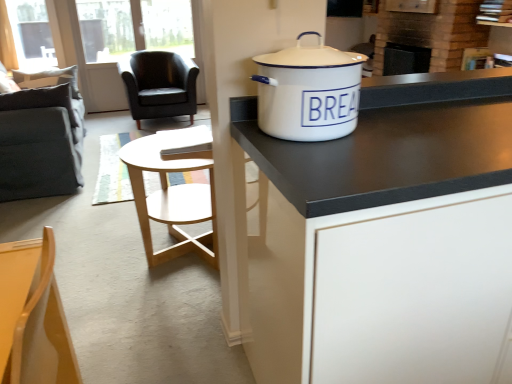
Question: Considering the relative positions of black matte cabinet at center and white enamel pot at upper right in the image provided, is black matte cabinet at center in front of white enamel pot at upper right?

Choices:
 (A) no
 (B) yes

Answer: (B)

Question: Is white enamel pot at upper right inside black matte cabinet at center?

Choices:
 (A) no
 (B) yes

Answer: (A)

Question: Is black matte cabinet at center not near white enamel pot at upper right?

Choices:
 (A) no
 (B) yes

Answer: (A)

Question: Considering the relative sizes of black matte cabinet at center and white enamel pot at upper right in the image provided, is black matte cabinet at center taller than white enamel pot at upper right?

Choices:
 (A) no
 (B) yes

Answer: (B)

Question: Is black matte cabinet at center to the left of white enamel pot at upper right from the viewer's perspective?

Choices:
 (A) no
 (B) yes

Answer: (A)

Question: Looking at the image, does black leather chair at upper left, placed as the first chair when sorted from back to front, seem bigger or smaller compared to white enamel pot at upper right?

Choices:
 (A) big
 (B) small

Answer: (A)

Question: From the image's perspective, is black leather chair at upper left, arranged as the first chair when viewed from the top, above or below white enamel pot at upper right?

Choices:
 (A) above
 (B) below

Answer: (A)

Question: Looking at their shapes, would you say black leather chair at upper left, which is the 2th chair in right-to-left order, is wider or thinner than white enamel pot at upper right?

Choices:
 (A) thin
 (B) wide

Answer: (B)

Question: Is point [x=158, y=82] closer or farther from the camera than point [x=321, y=96]?

Choices:
 (A) closer
 (B) farther

Answer: (B)

Question: From a real-world perspective, is wooden chair at lower left, acting as the 2th chair starting from the back, above or below black leather chair at upper left, the 2th chair when ordered from bottom to top?

Choices:
 (A) above
 (B) below

Answer: (A)

Question: Do you think wooden chair at lower left, the 1th chair from the bottom, is within black leather chair at upper left, placed as the first chair when sorted from back to front, or outside of it?

Choices:
 (A) outside
 (B) inside

Answer: (A)

Question: Is wooden chair at lower left, which is the 2th chair in top-to-bottom order, in front of or behind black leather chair at upper left, which is the 2th chair in right-to-left order, in the image?

Choices:
 (A) front
 (B) behind

Answer: (A)

Question: From the image's perspective, is wooden chair at lower left, acting as the 2th chair starting from the back, above or below black leather chair at upper left, arranged as the first chair when viewed from the top?

Choices:
 (A) below
 (B) above

Answer: (A)

Question: From a real-world perspective, relative to wooden chair at lower left, acting as the 2th chair starting from the back, is dark gray fabric swivel chair at left vertically above or below?

Choices:
 (A) above
 (B) below

Answer: (B)

Question: Choose the correct answer: Is dark gray fabric swivel chair at left inside wooden chair at lower left, marked as the 1th chair in a right-to-left arrangement, or outside it?

Choices:
 (A) inside
 (B) outside

Answer: (B)